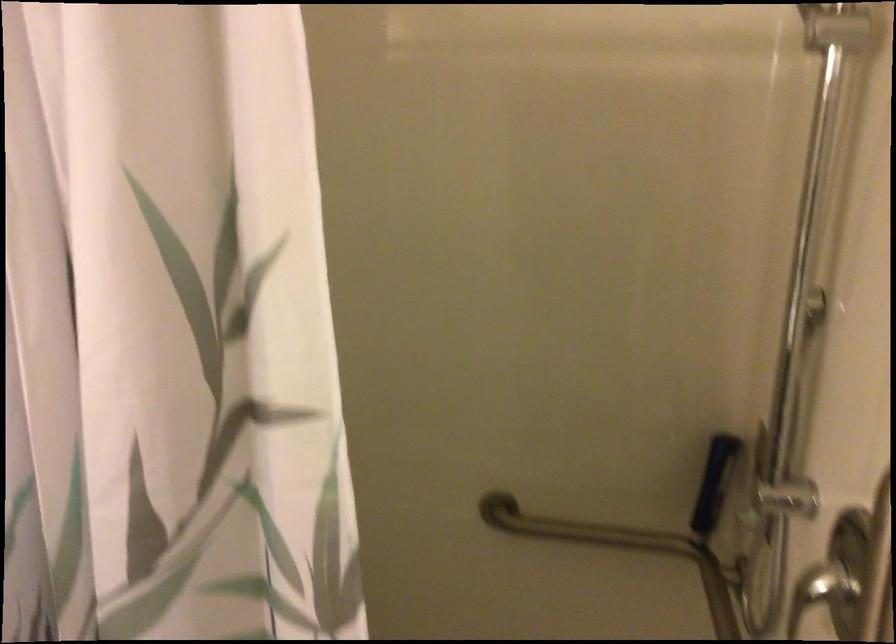
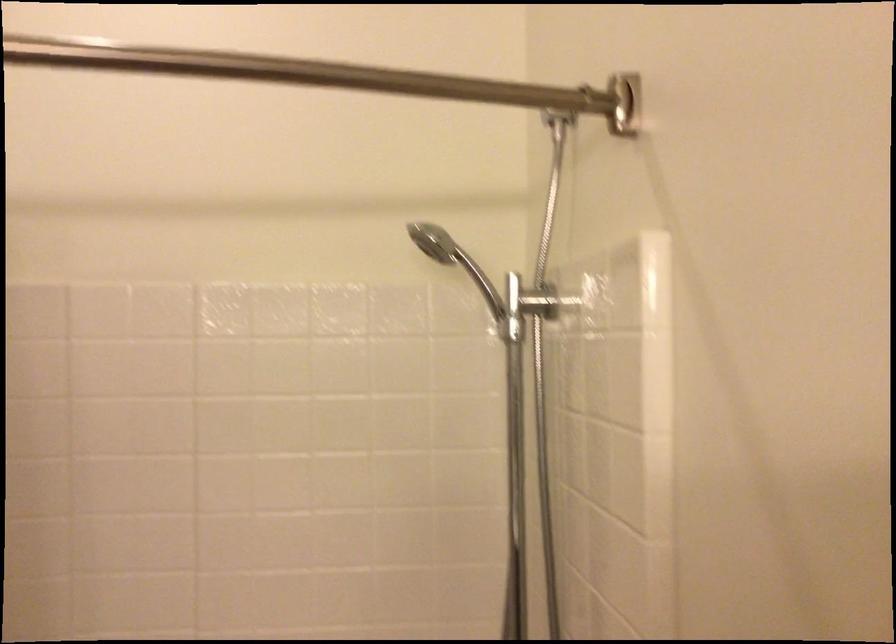
Question: In a continuous first-person perspective shot, in which direction is the camera moving?

Choices:
 (A) Left
 (B) Right
 (C) Forward
 (D) Backward

Answer: (A)